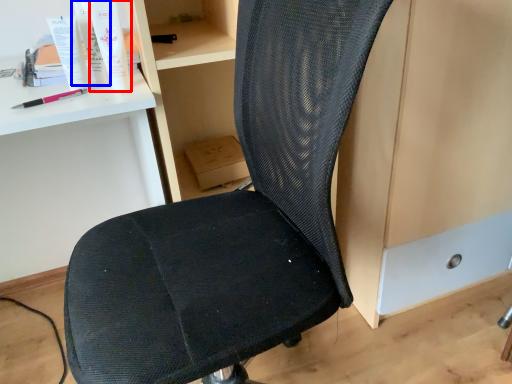
Question: Which point is further to the camera, toiletry (highlighted by a red box) or toiletry (highlighted by a blue box)?

Choices:
 (A) toiletry
 (B) toiletry

Answer: (B)